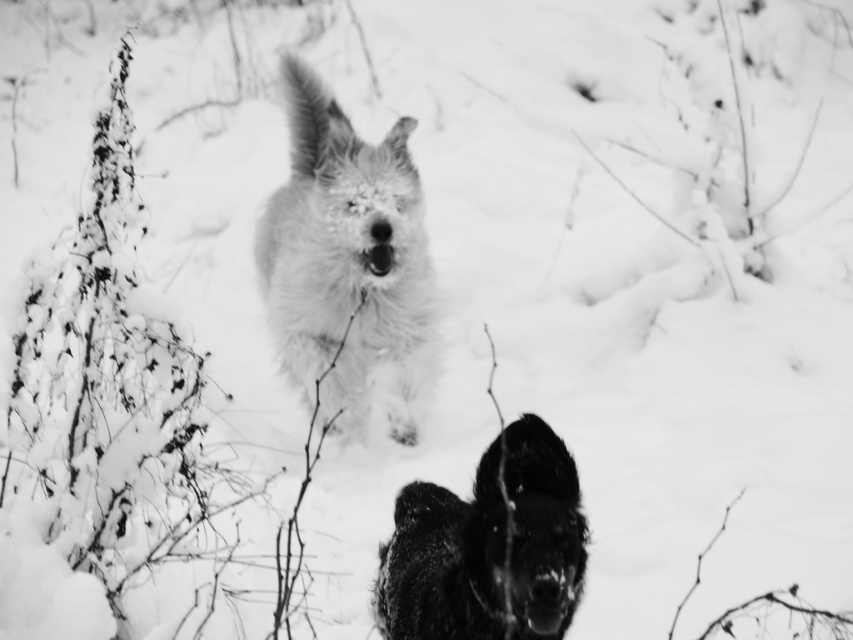
Who is higher up, fluffy white dog at center or fuzzy black dog at center?

fluffy white dog at center is above.

Does fluffy white dog at center have a greater width compared to fuzzy black dog at center?

Indeed, fluffy white dog at center has a greater width compared to fuzzy black dog at center.

Does point (397, 342) lie behind point (439, 515)?

Yes, point (397, 342) is farther from viewer.

This screenshot has width=853, height=640. What are the coordinates of `fluffy white dog at center` in the screenshot? It's located at [347, 260].